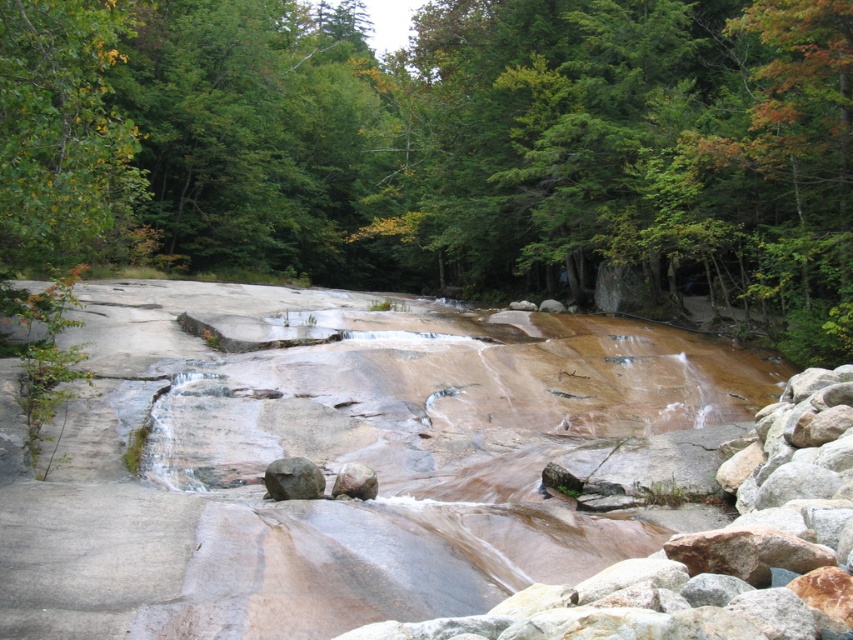
Between smooth brown rock at center and smooth gray rock at center, which one is positioned lower?

smooth gray rock at center is below.

Does smooth brown rock at center have a larger size compared to smooth gray rock at center?

Yes, smooth brown rock at center is bigger than smooth gray rock at center.

Which is behind, point (492, 627) or point (364, 499)?

Positioned behind is point (364, 499).

Find the location of a particular element. This screenshot has width=853, height=640. smooth brown rock at center is located at coordinates (714, 547).

Which is more to the right, rusty metallic rock at center or smooth gray rock at center?

Positioned to the right is smooth gray rock at center.

Does rusty metallic rock at center appear on the right side of smooth gray rock at center?

In fact, rusty metallic rock at center is to the left of smooth gray rock at center.

Is point (264, 496) farther from viewer compared to point (376, 483)?

No, (264, 496) is closer to viewer.

Locate an element on the screen. rusty metallic rock at center is located at coordinates (293, 477).

Is green leafy tree at upper left positioned behind rusty metallic rock at center?

Yes, green leafy tree at upper left is behind rusty metallic rock at center.

In the scene shown: Who is more distant from viewer, (13, 177) or (276, 488)?

Point (13, 177)

The image size is (853, 640). Identify the location of green leafy tree at upper left. (62, 132).